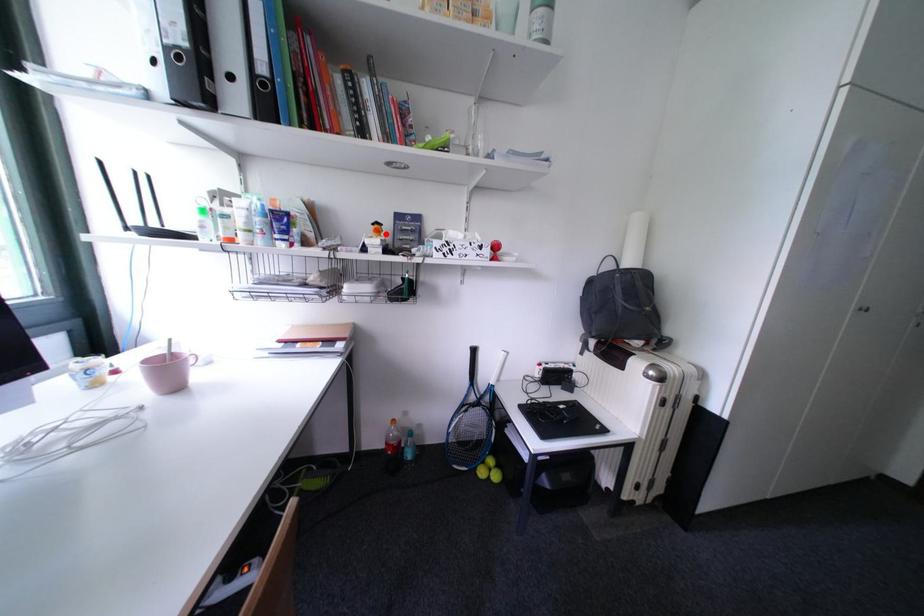
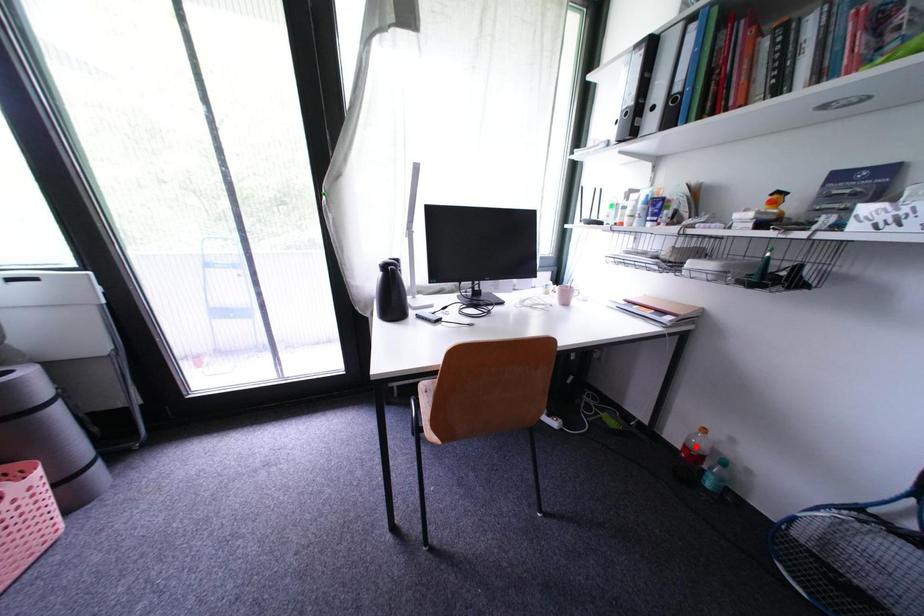
I am providing you with two images of the same scene from different viewpoints. A red point is marked on the first image and another point is marked on the second image. Do the highlighted points in image1 and image2 indicate the same real-world spot?

No